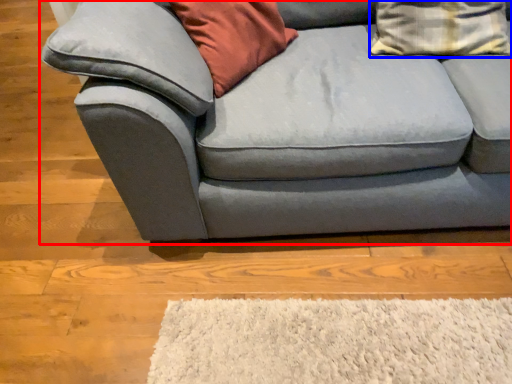
Question: Which object appears closest to the camera in this image, studio couch (highlighted by a red box) or pillow (highlighted by a blue box)?

Choices:
 (A) studio couch
 (B) pillow

Answer: (A)